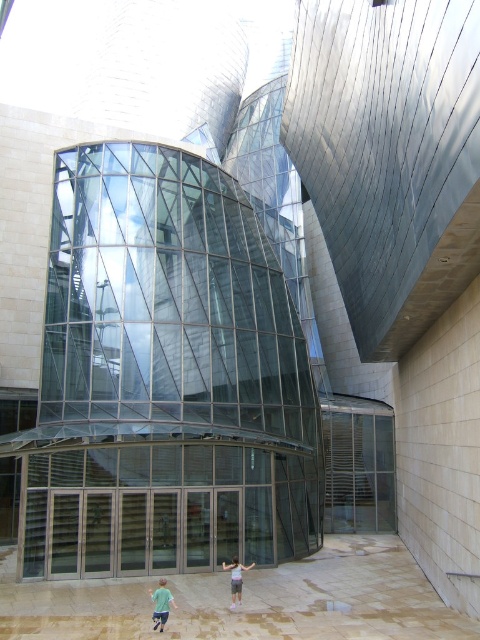
You are a fashion designer observing a model wearing the green matte shirt at lower center and the light blue denim shorts at center. Which clothing item has a shorter length?

The green matte shirt at lower center is shorter than the light blue denim shorts at center.

In the scene shown: You are standing in front of the modern architectural structure and notice a green matte shirt at lower center and a light blue denim shorts at center. Which item is positioned more to the left?

The green matte shirt at lower center is positioned more to the left than the light blue denim shorts at center.